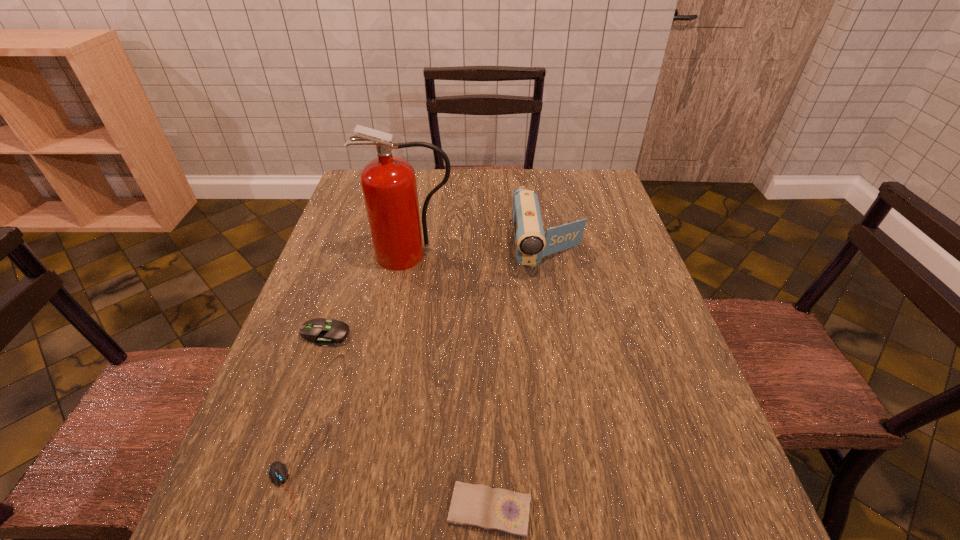
Locate an element on the screen. fire extinguisher is located at coordinates (389, 187).

Where is `the rightmost object`? This screenshot has height=540, width=960. the rightmost object is located at coordinates (531, 242).

Where is `the second tallest object`? the second tallest object is located at coordinates (531, 242).

Where is `the third farthest object`? This screenshot has width=960, height=540. the third farthest object is located at coordinates (323, 333).

I want to click on the farther mouse, so click(323, 333).

Find the location of `diary`. diary is located at coordinates (474, 505).

Identify the location of the shorter mouse. The width and height of the screenshot is (960, 540). (278, 471).

What are the coordinates of `free space located 0.260m with the handle and nozzle on the fire extinguisher` in the screenshot? It's located at click(395, 347).

Identify the location of free space located on the side of the rightmost object with the flip-out screen. The width and height of the screenshot is (960, 540). (560, 310).

Locate an element on the screen. The image size is (960, 540). vacant space located 0.380m on the right of the farther mouse is located at coordinates (514, 334).